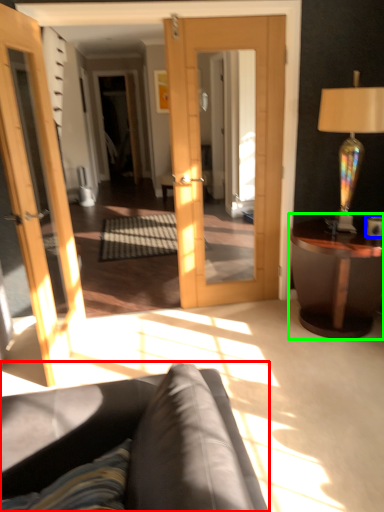
Question: Which object is positioned farthest from studio couch (highlighted by a red box)? Select from coffee cup (highlighted by a blue box) and table (highlighted by a green box).

Choices:
 (A) coffee cup
 (B) table

Answer: (A)